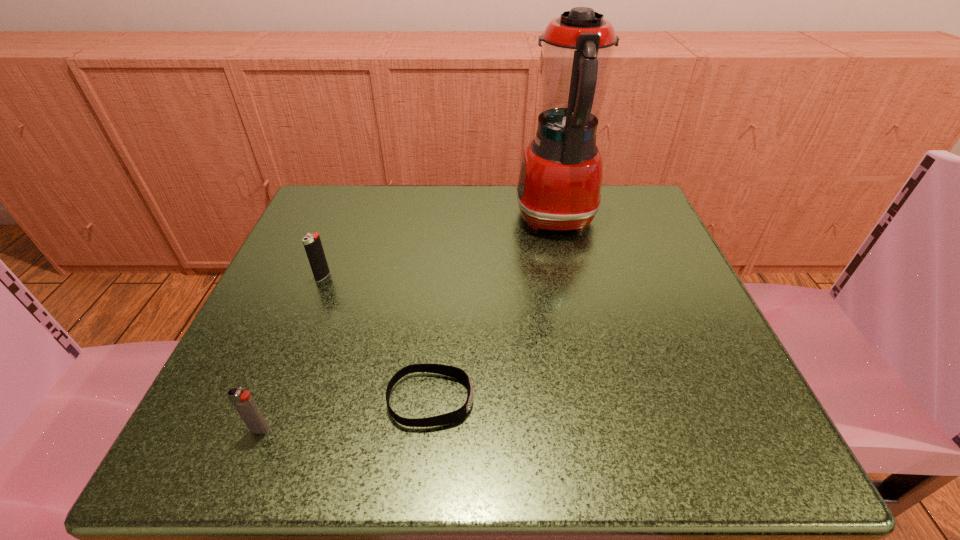
Locate an element on the screen. Image resolution: width=960 pixels, height=540 pixels. blank space located 0.150m on the back of the nearer igniter is located at coordinates (297, 339).

Locate an element on the screen. This screenshot has height=540, width=960. vacant space located on the display of the shortest object is located at coordinates (538, 400).

Where is `object located at the far edge`? The height and width of the screenshot is (540, 960). object located at the far edge is located at coordinates (560, 179).

You are a GUI agent. You are given a task and a screenshot of the screen. Output one action in this format:
    pyautogui.click(x=<x>, y=<y>)
    Task: Click on the igniter present at the near edge
    
    Given the screenshot: What is the action you would take?
    pyautogui.click(x=243, y=402)

The width and height of the screenshot is (960, 540). I want to click on wristband that is at the near edge, so click(451, 371).

Find the location of a particular element. object located at the right edge is located at coordinates pyautogui.click(x=560, y=179).

This screenshot has height=540, width=960. I want to click on object situated at the near left corner, so click(243, 402).

The image size is (960, 540). Find the location of `object that is positioned at the far right corner`. object that is positioned at the far right corner is located at coordinates (560, 179).

In the image, there is a desktop. At what (x,y) coordinates should I click in order to perform the action: click on vacant space at the far edge. Please return your answer as a coordinate pair (x, y). Looking at the image, I should click on (471, 240).

Image resolution: width=960 pixels, height=540 pixels. Identify the location of vacant region at the near edge of the desktop. (337, 421).